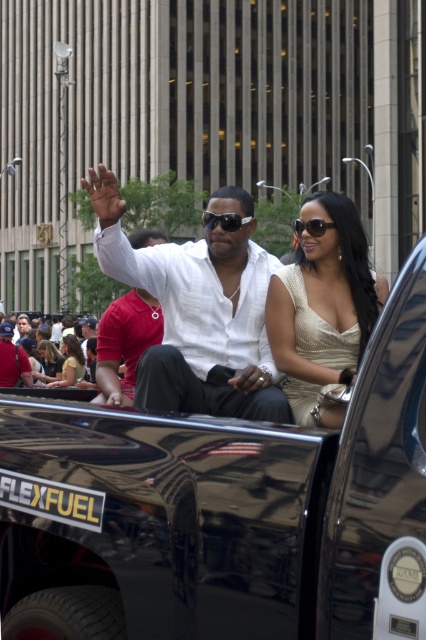
Looking at this image, you are a photographer trying to capture a clear shot of the white cotton shirt at center and the light brown leather chairs at lower left. Which object will appear bigger in your photo?

The white cotton shirt at center will appear bigger in the photo because it is larger in size than the light brown leather chairs at lower left.

You are a photographer trying to capture a clear shot of both the white cotton shirt at center and the light yellow fabric shirt at center. Which one should you focus on first to ensure both are in focus?

You should focus on the white cotton shirt at center first since it is closer to the viewer. By focusing on the closer object, the light yellow fabric shirt at center will also be in focus due to the depth of field.

Based on the scene description, can you determine which object is taller between the white cotton shirt at center and the light brown leather chairs at lower left?

The white cotton shirt at center is taller than the light brown leather chairs at lower left according to the description.